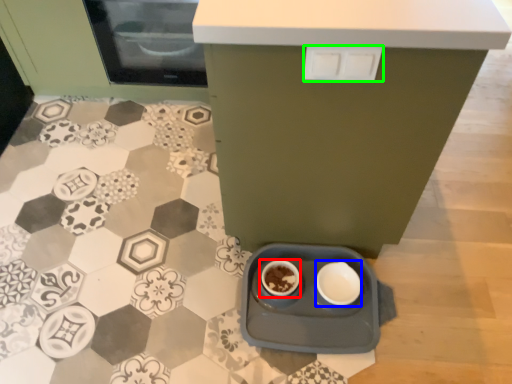
Question: Which object is positioned closest to coffee cup (highlighted by a red box)? Select from bowl (highlighted by a blue box) and drawer (highlighted by a green box).

Choices:
 (A) bowl
 (B) drawer

Answer: (A)